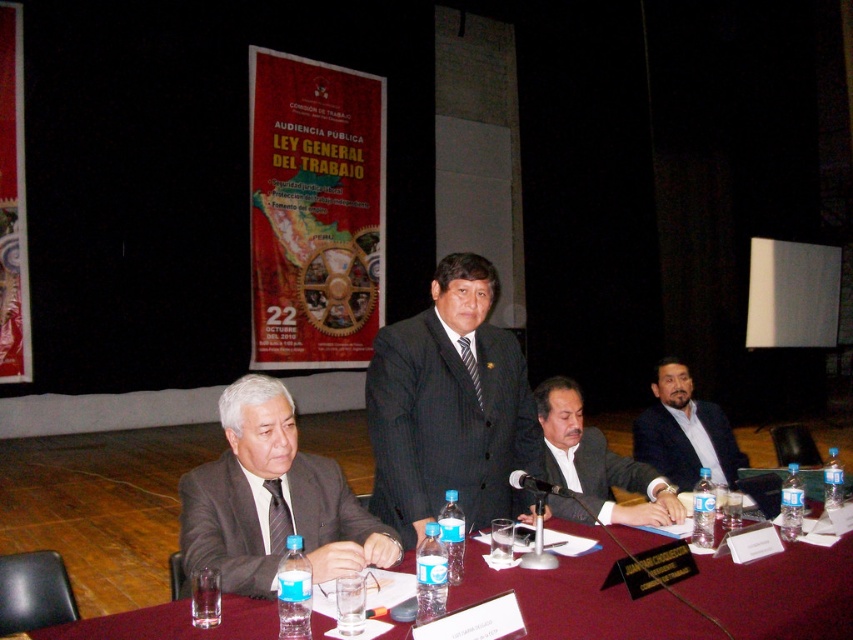
Based on the scene description, what object is located at the coordinates point [314,212]?

The red paper poster at upper center is located at point [314,212].

Consider the image. You are attending a public hearing about labor law. You see the red fabric banner at upper left and the dark blue suit at center. Which object is taller?

The red fabric banner at upper left is taller than the dark blue suit at center.